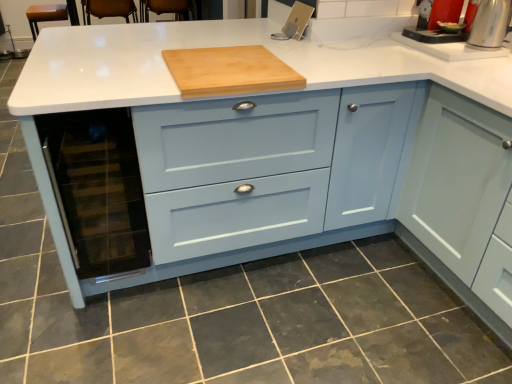
At what (x,y) coordinates should I click in order to perform the action: click on blank space situated above dark gray tile at lower center (from a real-world perspective). Please return your answer as a coordinate pair (x, y). This screenshot has height=384, width=512. Looking at the image, I should click on (246, 319).